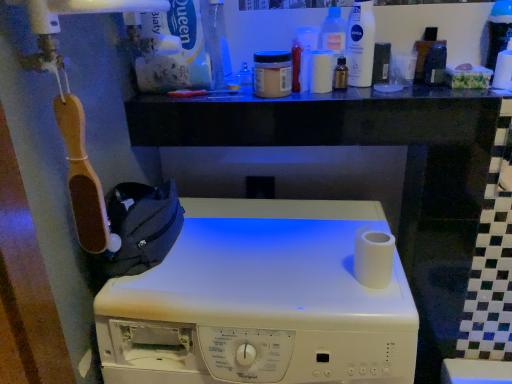
Question: Could you tell me if translucent amber bottle at upper center, the second toiletry in the right-to-left sequence, is facing translucent plastic bottle at upper center, which is the 2th cleaning product from right to left?

Choices:
 (A) yes
 (B) no

Answer: (B)

Question: From a real-world perspective, is translucent amber bottle at upper center, the 5th toiletry from the left, positioned over translucent plastic bottle at upper center, which is the 2th cleaning product from right to left, based on gravity?

Choices:
 (A) no
 (B) yes

Answer: (A)

Question: Is translucent amber bottle at upper center, the 5th toiletry from the left, to the left of translucent plastic bottle at upper center, which is counted as the 1th cleaning product, starting from the left, from the viewer's perspective?

Choices:
 (A) no
 (B) yes

Answer: (A)

Question: Is translucent amber bottle at upper center, the second toiletry in the right-to-left sequence, bigger than translucent plastic bottle at upper center, which is the 2th cleaning product from right to left?

Choices:
 (A) no
 (B) yes

Answer: (A)

Question: Is translucent amber bottle at upper center, the 5th toiletry from the left, located outside translucent plastic bottle at upper center, which is counted as the 1th cleaning product, starting from the left?

Choices:
 (A) yes
 (B) no

Answer: (A)

Question: Is translucent amber bottle at upper center, the second toiletry in the right-to-left sequence, in contact with translucent plastic bottle at upper center, which is the 2th cleaning product from right to left?

Choices:
 (A) no
 (B) yes

Answer: (B)

Question: Is white matte toilet paper at right, which is the first toilet paper in front-to-back order, not inside matte black container at upper right, the first toiletry when ordered from right to left?

Choices:
 (A) no
 (B) yes

Answer: (B)

Question: From the image's perspective, is white matte toilet paper at right, which is the first toilet paper in front-to-back order, located above matte black container at upper right, which is counted as the sixth toiletry, starting from the left?

Choices:
 (A) no
 (B) yes

Answer: (A)

Question: Could you tell me if white matte toilet paper at right, acting as the 1th toilet paper starting from the bottom, is turned towards matte black container at upper right, the first toiletry when ordered from right to left?

Choices:
 (A) no
 (B) yes

Answer: (A)

Question: From the image's perspective, does white matte toilet paper at right, arranged as the first toilet paper when viewed from the left, appear lower than matte black container at upper right, the first toiletry when ordered from right to left?

Choices:
 (A) yes
 (B) no

Answer: (A)

Question: Does white matte toilet paper at right, which is the first toilet paper in front-to-back order, have a lesser width compared to matte black container at upper right, the first toiletry when ordered from right to left?

Choices:
 (A) yes
 (B) no

Answer: (B)

Question: Is white matte toilet paper at right, arranged as the 2th toilet paper when viewed from the right, shorter than matte black container at upper right, which is counted as the sixth toiletry, starting from the left?

Choices:
 (A) no
 (B) yes

Answer: (B)

Question: Could you tell me if translucent amber bottle at upper center, the 5th toiletry from the left, is facing transparent glass bottle at upper center?

Choices:
 (A) no
 (B) yes

Answer: (A)